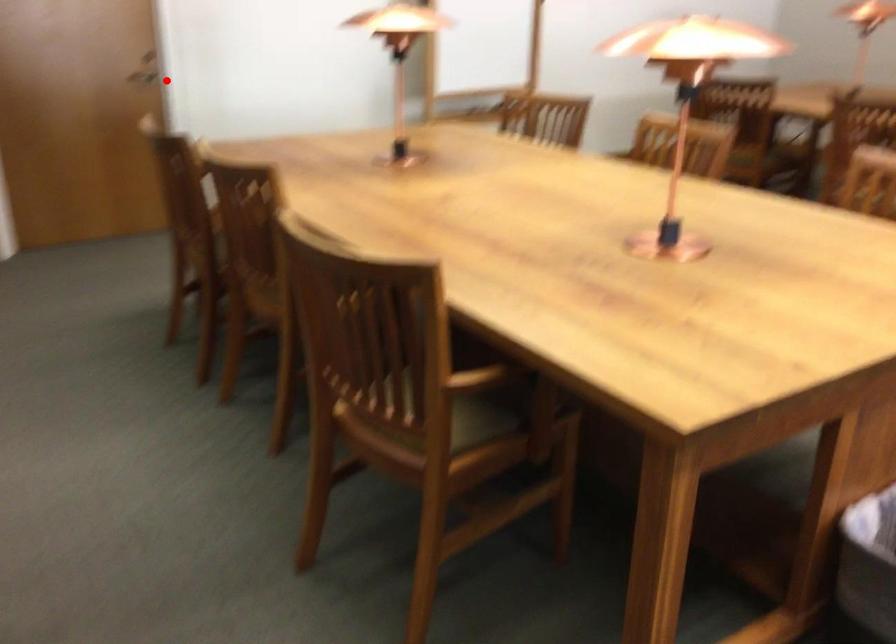
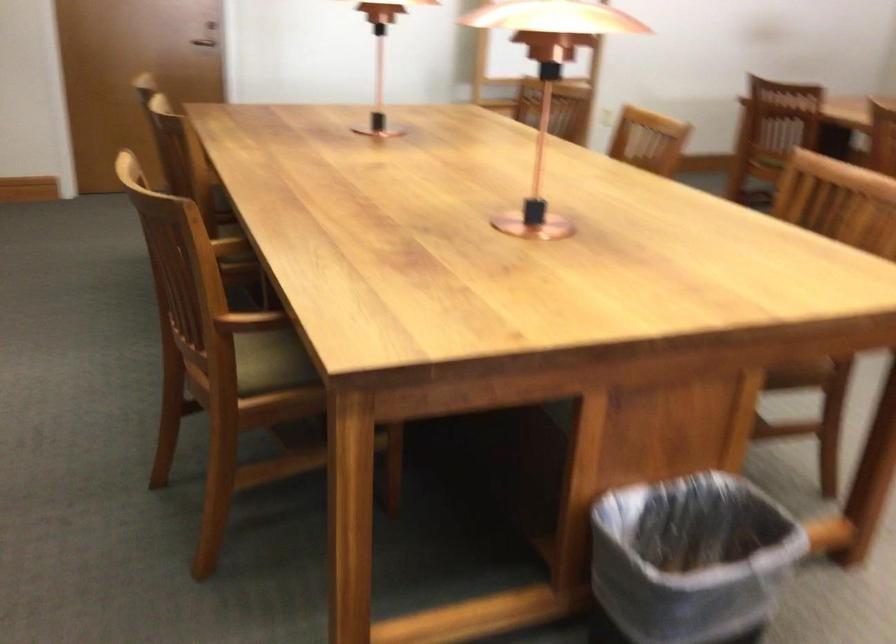
The point at the highlighted location is marked in the first image. Where is the corresponding point in the second image?

(202, 42)